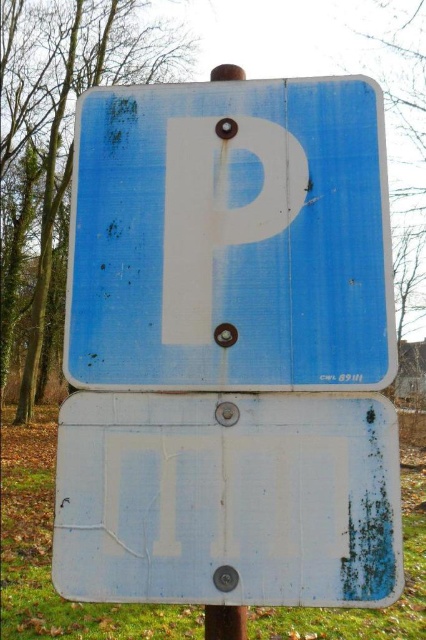
You are a delivery driver who needs to park near these two road signs. The parking space must accommodate a vehicle that is 2 meters tall. Given that the matte blue parking sign at center is taller than the white matte sign at center, can you determine which sign you should avoid hitting if you park under them?

The matte blue parking sign at center is taller than the white matte sign at center. Since your vehicle is 2 meters tall, you should avoid hitting the taller matte blue parking sign at center to prevent damage.

You are a driver trying to read two road signs on a pole. The matte blue parking sign at center and the white matte sign at center are both present. Which one is located higher up on the pole?

The matte blue parking sign at center is above the white matte sign at center, so it is located higher up on the pole.